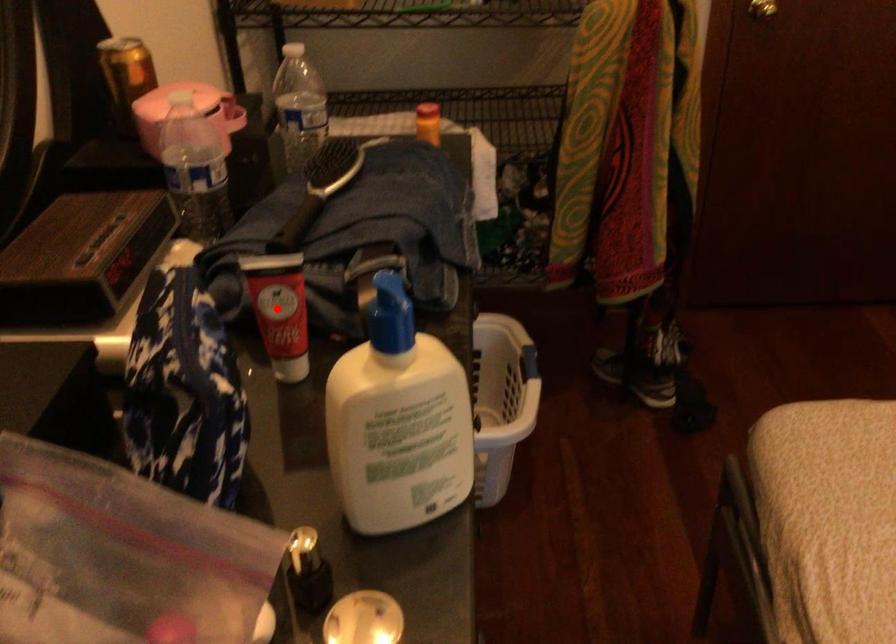
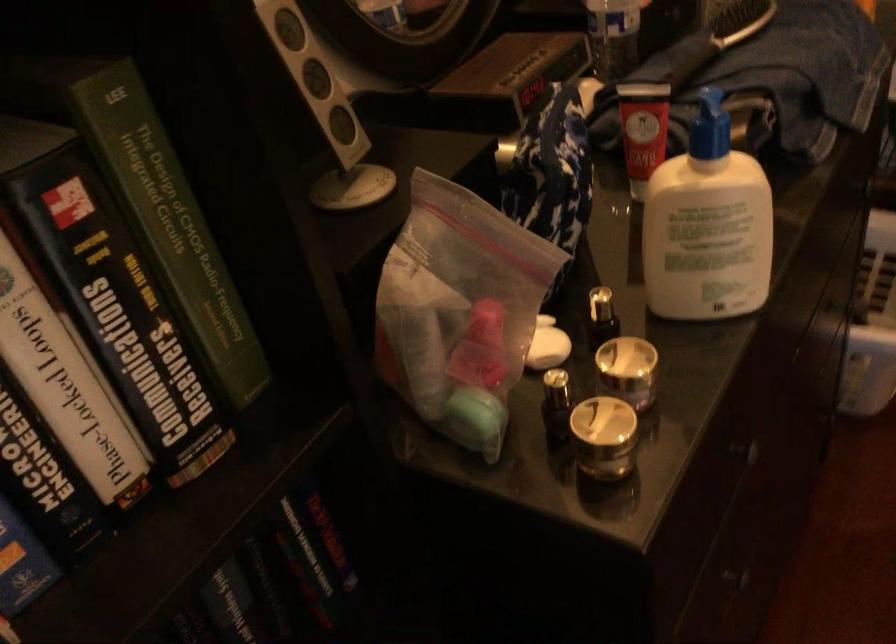
Question: I am providing you with two images of the same scene from different viewpoints. In image1, a red point is highlighted. Considering the same 3D point in image2, which of the following is correct?

Choices:
 (A) It is closer
 (B) It is farther

Answer: (B)